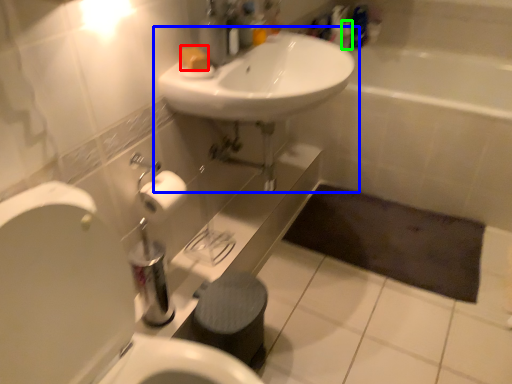
Question: Based on their relative distances, which object is farther from soap (highlighted by a red box)? Choose from sink (highlighted by a blue box) and toiletry (highlighted by a green box).

Choices:
 (A) sink
 (B) toiletry

Answer: (B)